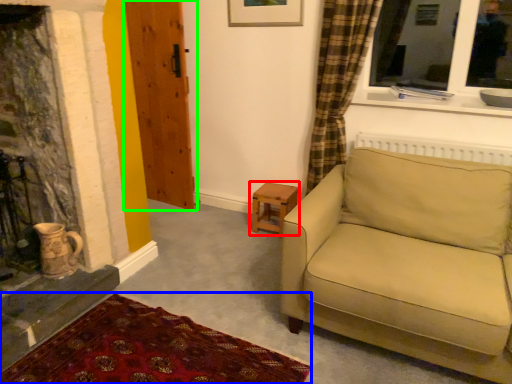
Question: Which object is the closest to the table (highlighted by a red box)? Choose among these: plain (highlighted by a blue box) or door (highlighted by a green box).

Choices:
 (A) plain
 (B) door

Answer: (B)